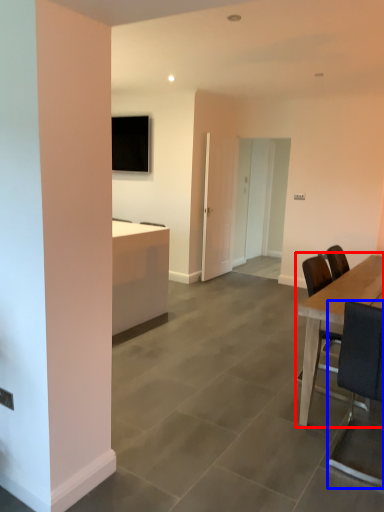
Question: Which point is further to the camera, table (highlighted by a red box) or chair (highlighted by a blue box)?

Choices:
 (A) table
 (B) chair

Answer: (A)